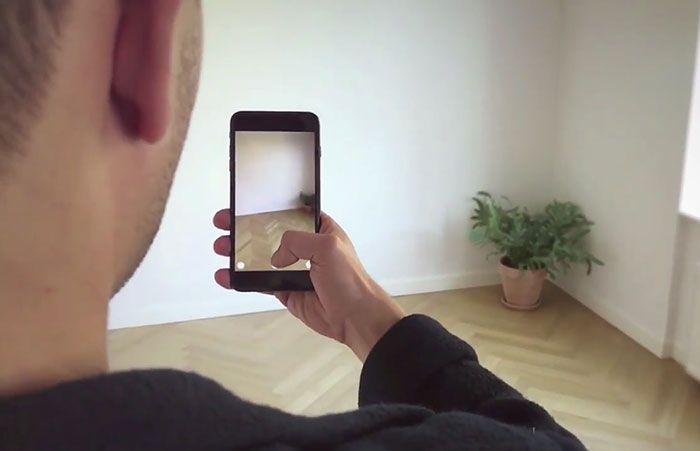
The width and height of the screenshot is (700, 451). I want to click on plant pot, so click(x=530, y=285).